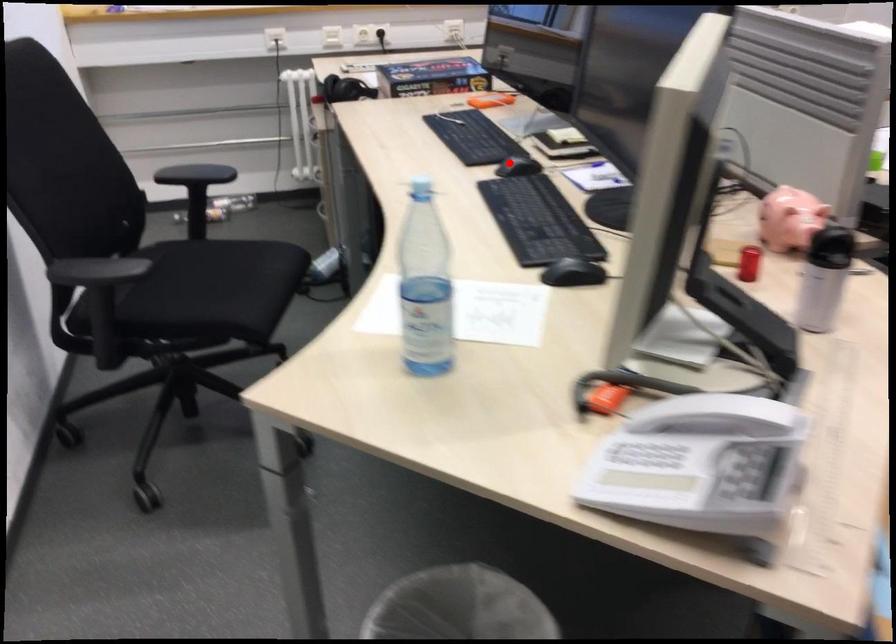
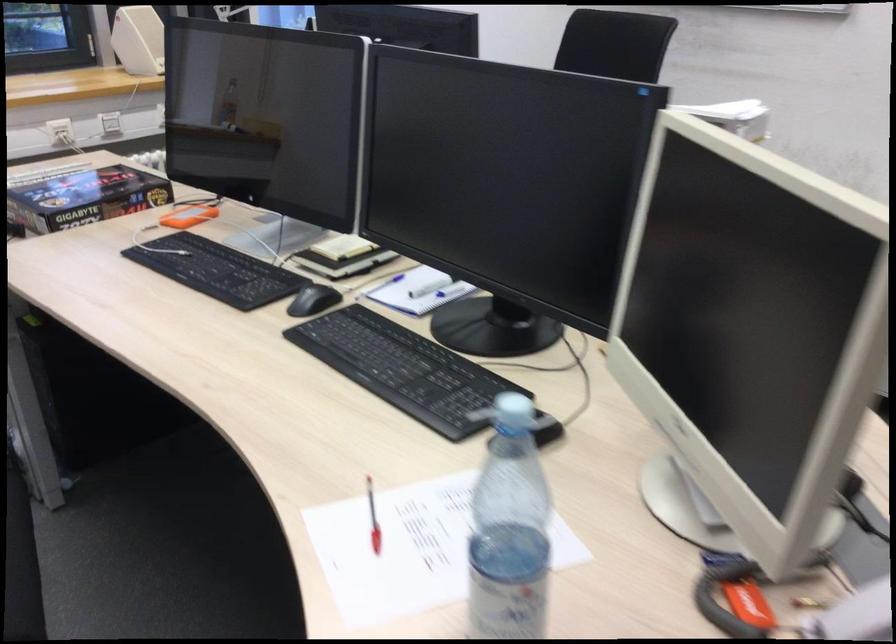
Question: I am providing you with two images of the same scene from different viewpoints. Given a red point in image1, look at the same physical point in image2. Is it:

Choices:
 (A) Closer to the viewpoint
 (B) Farther from the viewpoint

Answer: (A)